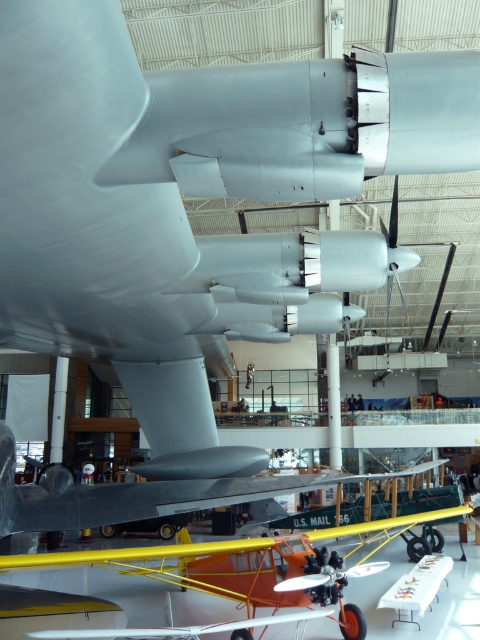
Question: Among these points, which one is farthest from the camera?

Choices:
 (A) (183, 497)
 (B) (272, 564)

Answer: (B)

Question: Is orange matte airplane at lower center further to camera compared to metallic silver airplane at center?

Choices:
 (A) yes
 (B) no

Answer: (A)

Question: Which point appears closest to the camera in this image?

Choices:
 (A) (11, 568)
 (B) (11, 513)

Answer: (A)

Question: Is orange matte airplane at lower center to the right of metallic silver airplane at center from the viewer's perspective?

Choices:
 (A) yes
 (B) no

Answer: (A)

Question: Which of the following is the farthest from the observer?

Choices:
 (A) metallic silver airplane at center
 (B) orange matte airplane at lower center

Answer: (B)

Question: Is orange matte airplane at lower center positioned behind metallic silver airplane at center?

Choices:
 (A) yes
 (B) no

Answer: (A)